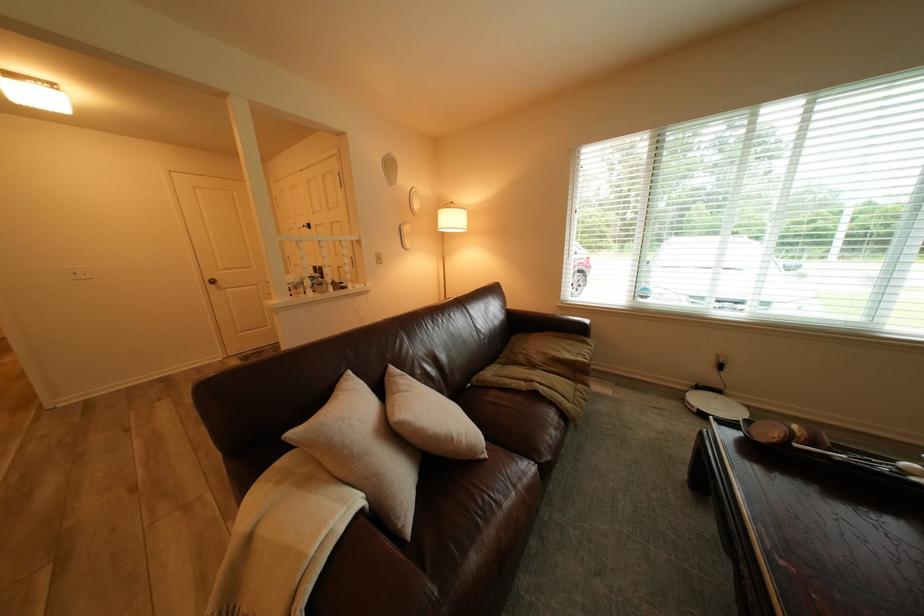
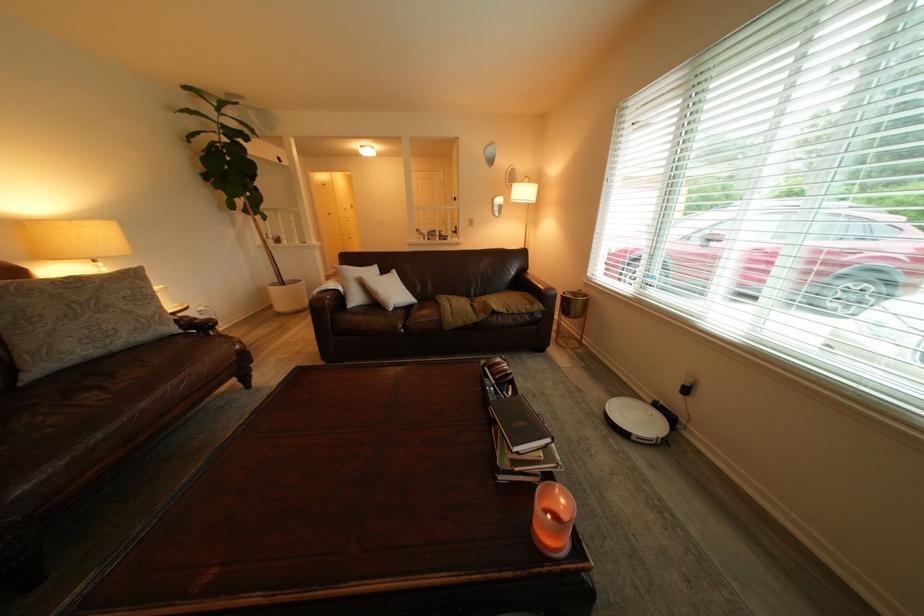
The point at (x=809, y=446) is marked in the first image. Where is the corresponding point in the second image?

(500, 369)